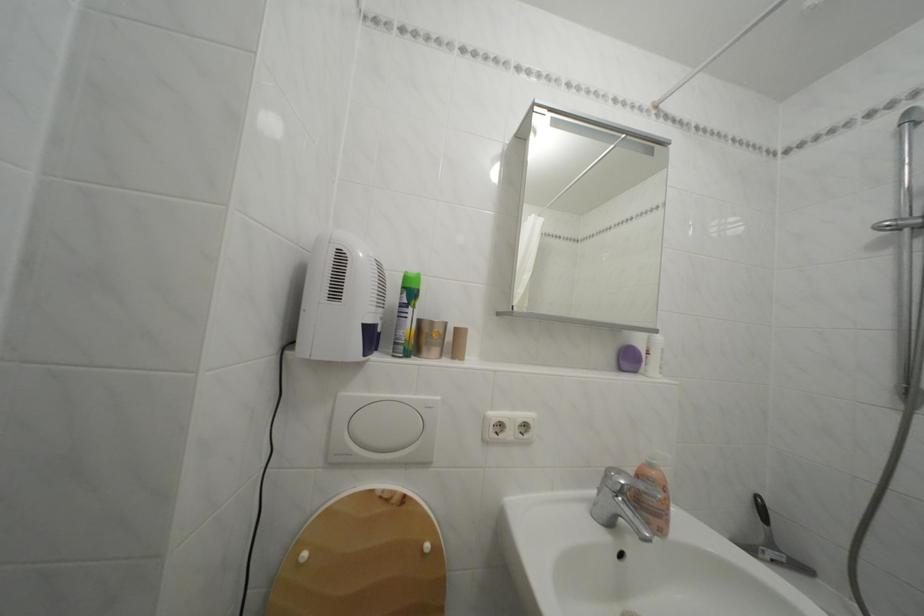
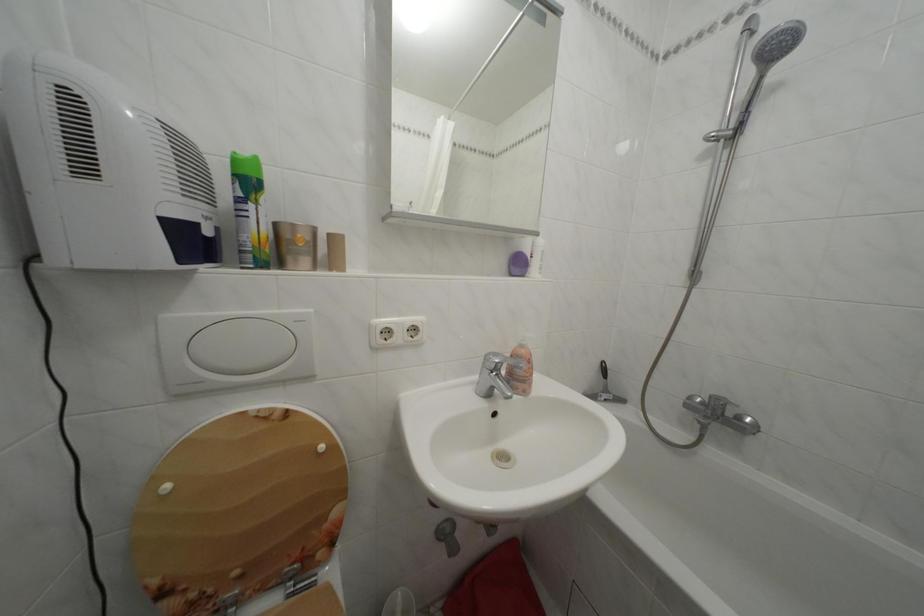
The images are taken continuously from a first-person perspective. In which direction is your viewpoint rotating?

The rotation direction of the camera is right-down.